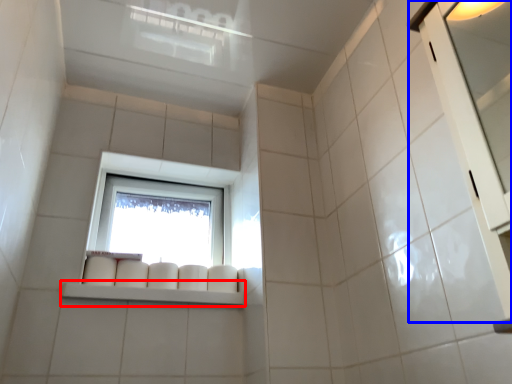
Question: Which object is closer to the camera taking this photo, window sill (highlighted by a red box) or screen door (highlighted by a blue box)?

Choices:
 (A) window sill
 (B) screen door

Answer: (B)